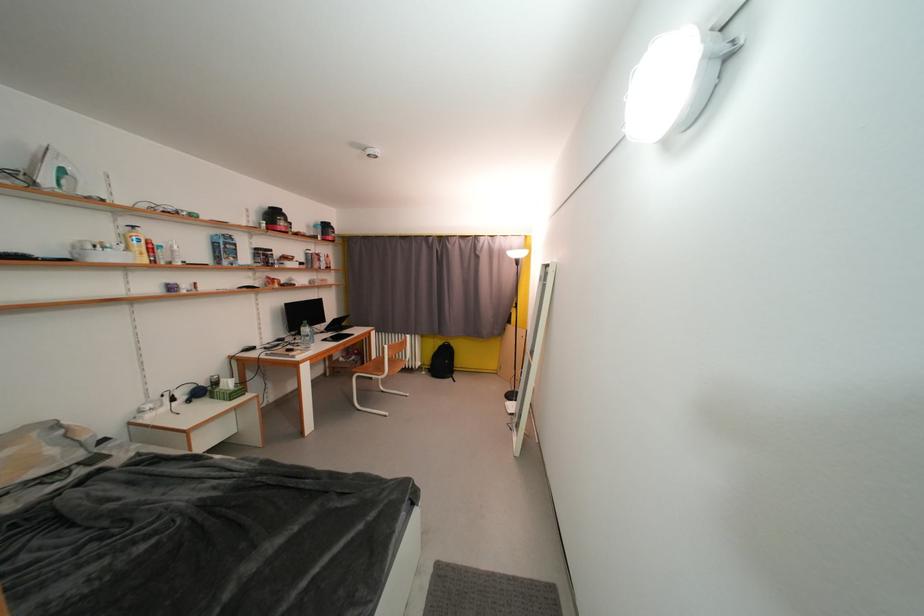
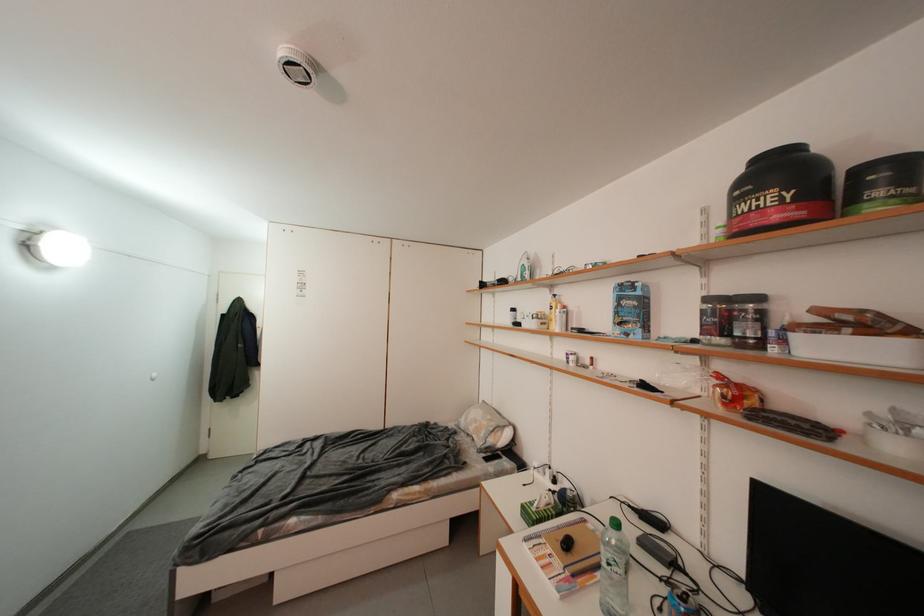
In the second image, find the point that corresponds to pixel 233 246 in the first image.

(627, 302)